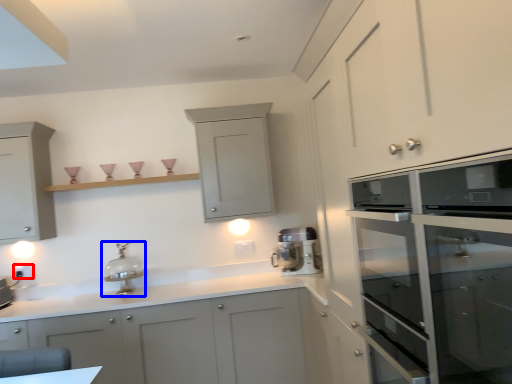
Question: Which object appears farthest to the camera in this image, electric outlet (highlighted by a red box) or kitchen appliance (highlighted by a blue box)?

Choices:
 (A) electric outlet
 (B) kitchen appliance

Answer: (A)